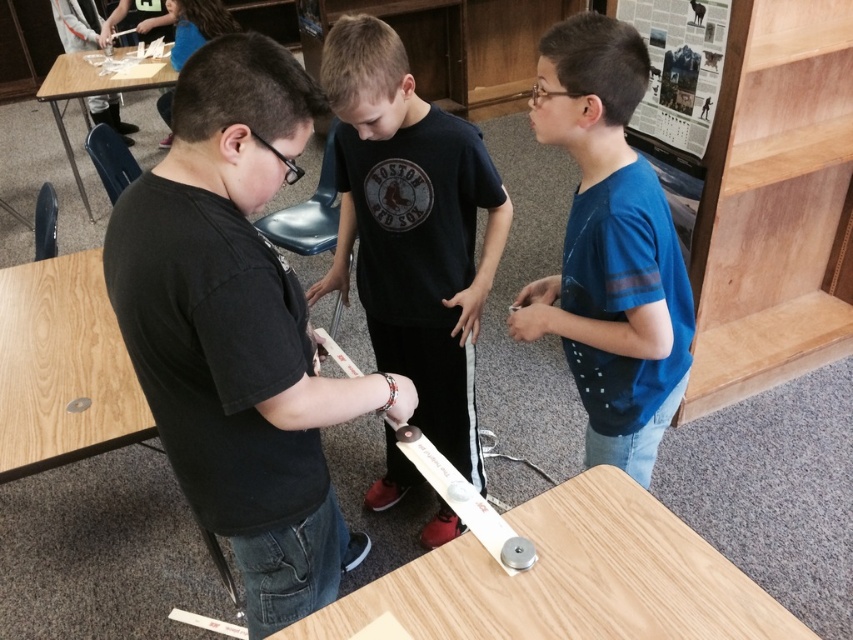
You are a teacher observing the students. You need to place a safety manual on the light brown wood table at center so that it is visible to the student in the blue cotton shirt at center. Is the table positioned in a way that allows the student to see the manual without moving?

The light brown wood table at center is behind the blue cotton shirt at center, so the student in the blue cotton shirt at center would have to turn around or move to see the manual placed there.

What are the coordinates of the black matte shirt at center?

The coordinates of the black matte shirt at center are at point [236,326].